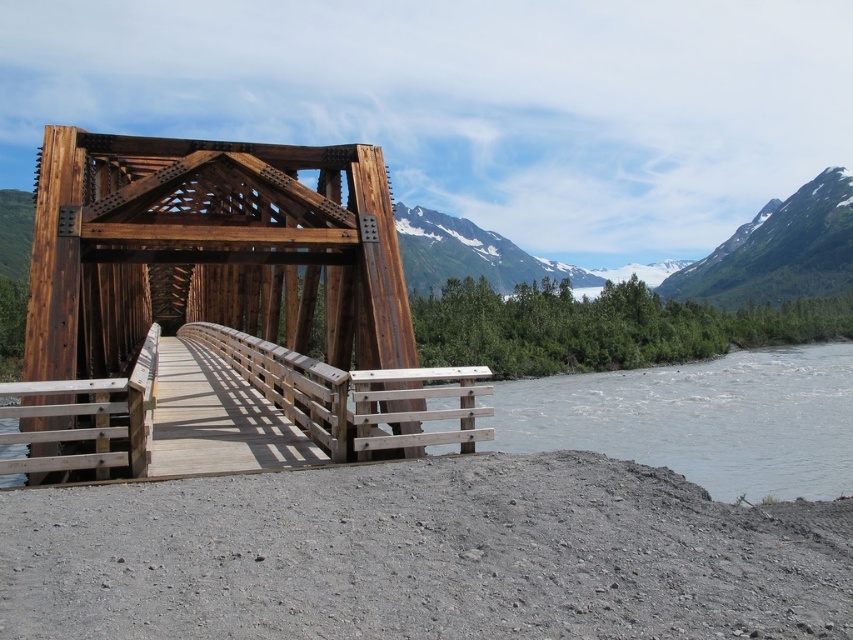
Question: Among these points, which one is farthest from the camera?

Choices:
 (A) (817, 241)
 (B) (408, 392)

Answer: (A)

Question: Is matte brown wooden bridge at center to the right of green forested mountain at upper right from the viewer's perspective?

Choices:
 (A) yes
 (B) no

Answer: (B)

Question: Among these points, which one is farthest from the camera?

Choices:
 (A) (50, 273)
 (B) (741, 230)

Answer: (B)

Question: Can you confirm if matte brown wooden bridge at center is positioned below green forested mountain at upper right?

Choices:
 (A) no
 (B) yes

Answer: (B)

Question: Among these points, which one is farthest from the camera?

Choices:
 (A) (77, 205)
 (B) (779, 220)

Answer: (B)

Question: Where is matte brown wooden bridge at center located in relation to green forested mountain at upper right in the image?

Choices:
 (A) below
 (B) above

Answer: (A)